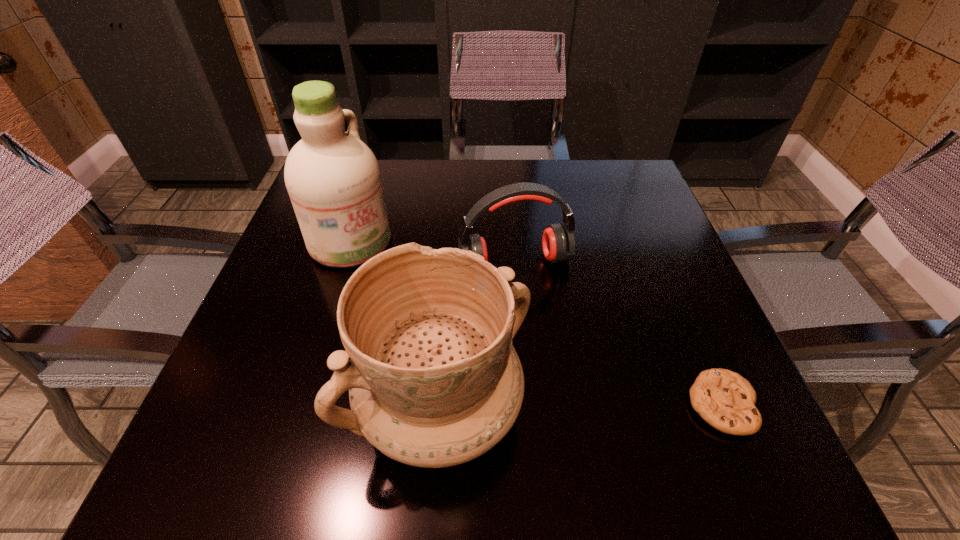
This screenshot has width=960, height=540. In order to click on vacant space situated on the front label of the tallest object in this screenshot , I will do click(473, 327).

You are a GUI agent. You are given a task and a screenshot of the screen. Output one action in this format:
    pyautogui.click(x=<x>, y=<y>)
    Task: Click on the vacant space positioned on the ear cups of the earphone
    
    Given the screenshot: What is the action you would take?
    pyautogui.click(x=540, y=312)

Identify the location of free space located on the ear cups of the earphone. (543, 323).

The width and height of the screenshot is (960, 540). I want to click on free space located on the ear cups of the earphone, so click(x=540, y=312).

In order to click on pottery present at the near edge in this screenshot , I will do `click(434, 381)`.

Locate an element on the screen. The width and height of the screenshot is (960, 540). cookie that is at the near edge is located at coordinates (724, 399).

What are the coordinates of `object that is at the left edge` in the screenshot? It's located at (333, 179).

Locate an element on the screen. object at the right edge is located at coordinates (724, 399).

Identify the location of object that is at the near right corner. (724, 399).

Locate an element on the screen. The height and width of the screenshot is (540, 960). vacant area at the far edge is located at coordinates pos(520,179).